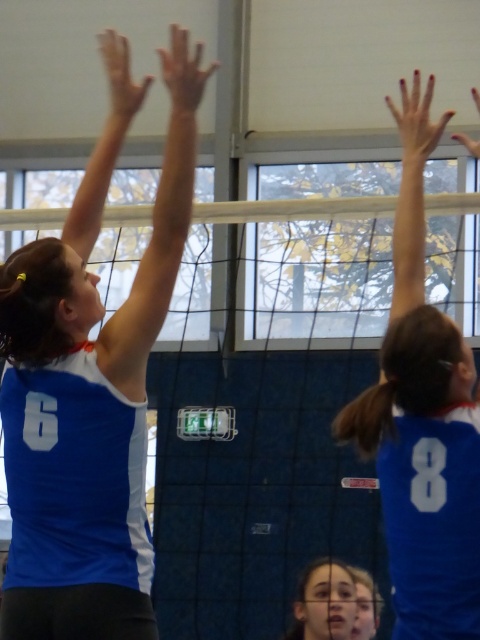
You are a referee observing the volleyball game and need to determine if the players are positioned correctly according to the rules. The rule states that the player on the left must be taller than the player on the right to form a legal block. Are the blue jersey at upper left and blue jersey at upper right positioned legally?

The blue jersey at upper left is much taller than the blue jersey at upper right, so their positioning meets the requirement for a legal block according to the rule.

You are a referee in the volleyball game and need to ensure the net is positioned correctly. According to the court dimensions, the net should be placed at the midpoint of the court. Is the white mesh net at center positioned correctly based on its 2D coordinates?

The white mesh net at center is positioned correctly as its 2D coordinates are at the midpoint of the court, which is point (x=255, y=484).

You are a referee watching the volleyball game. You need to determine the direction the ball is moving based on the positions of the blue jersey at upper left and the blue jersey at upper right. Which direction is the ball likely moving towards?

The blue jersey at upper left is positioned on the left side of blue jersey at upper right, so the ball is likely moving towards the right side of the frame.